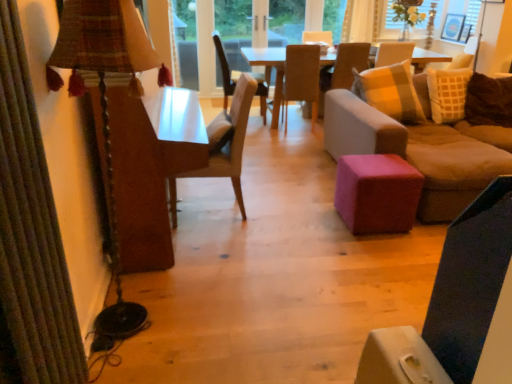
This screenshot has height=384, width=512. In order to click on vacant area that is in front of wooden chair at center, the 4th chair positioned from the back in this screenshot , I will do `click(239, 241)`.